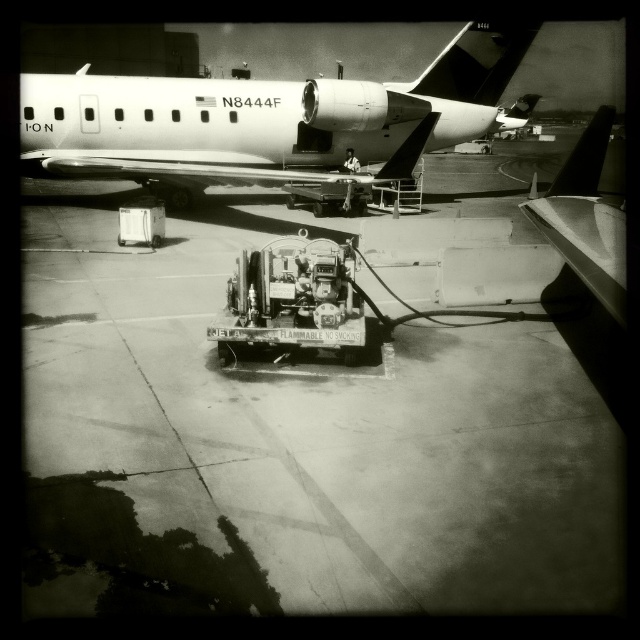
You are standing at the point labeled point (90, 131) and want to walk towards the fueling unit. Is the point labeled point (561, 376) in your path?

Yes, the point labeled point (561, 376) is in your path because it is closer to you than point (90, 131).

You are a maintenance worker at the airport. You need to park a new equipment vehicle on the smooth concrete tarmac at center without overlapping the metallic white airplane at upper left. Is the tarmac wide enough for the vehicle?

The smooth concrete tarmac at center has a lesser width compared to metallic white airplane at upper left, so it may not be wide enough to park the vehicle without overlapping the airplane.

You are a pilot standing on the smooth concrete tarmac at center and looking towards the metallic white airplane at upper left. Which object is taller from your perspective?

The metallic white airplane at upper left is taller than the smooth concrete tarmac at center.